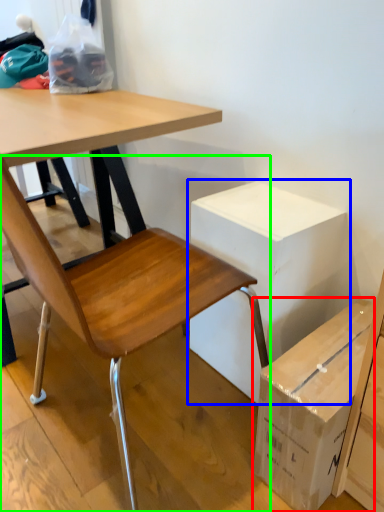
Question: Considering the real-world distances, which object is farthest from box (highlighted by a red box)? cardboard box (highlighted by a blue box) or chair (highlighted by a green box)?

Choices:
 (A) cardboard box
 (B) chair

Answer: (B)